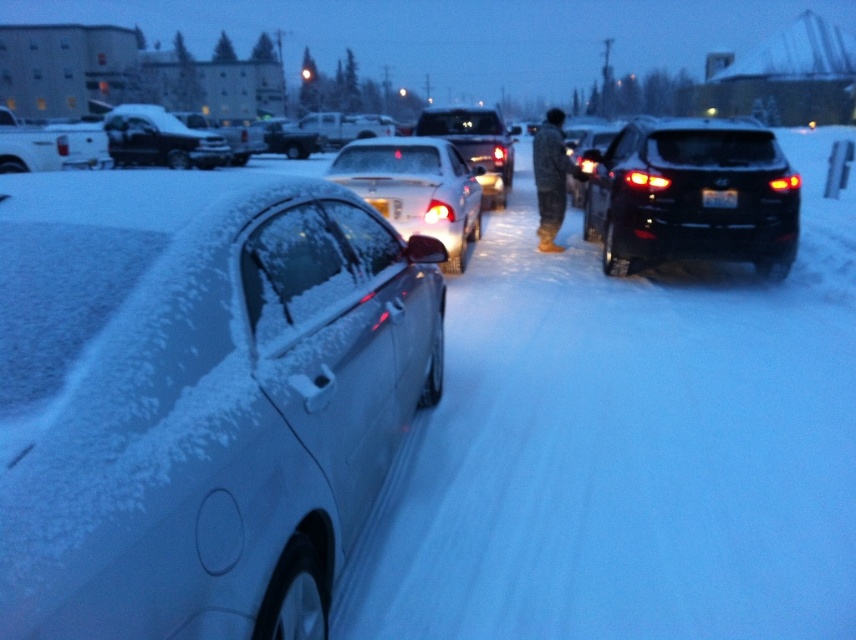
Between black matte suv at center and snow-covered suv at left, which one has more height?

snow-covered suv at left is taller.

Is black matte suv at center smaller than snow-covered suv at left?

Indeed, black matte suv at center has a smaller size compared to snow-covered suv at left.

Is point (617, 236) positioned behind point (162, 141)?

No, (617, 236) is in front of (162, 141).

Identify the location of black matte suv at center. (693, 196).

At what (x,y) coordinates should I click in order to perform the action: click on white matte car at left. Please return your answer as a coordinate pair (x, y). Looking at the image, I should click on (198, 396).

Is point (623, 134) farther from viewer compared to point (462, 248)?

Yes.

Who is taller, black matte suv at center or white glossy sedan at center?

black matte suv at center

Locate an element on the screen. Image resolution: width=856 pixels, height=640 pixels. black matte suv at center is located at coordinates (693, 196).